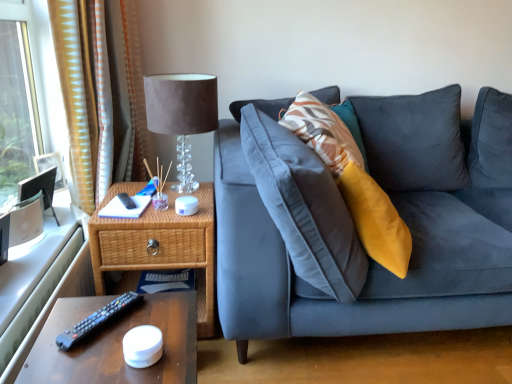
I want to click on free location to the right of black plastic remote at lower left, so click(x=162, y=320).